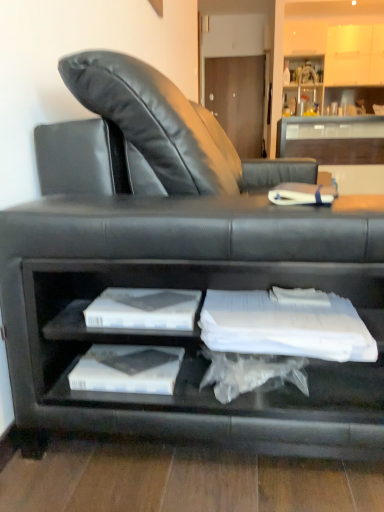
Question: Is white paper at center next to clear glass table at upper center and touching it?

Choices:
 (A) yes
 (B) no

Answer: (B)

Question: From the image's perspective, is white paper at center on top of clear glass table at upper center?

Choices:
 (A) yes
 (B) no

Answer: (B)

Question: Is white paper at center oriented towards clear glass table at upper center?

Choices:
 (A) no
 (B) yes

Answer: (A)

Question: Is white paper at center at the left side of clear glass table at upper center?

Choices:
 (A) no
 (B) yes

Answer: (B)

Question: Is white paper at center not inside clear glass table at upper center?

Choices:
 (A) no
 (B) yes

Answer: (B)

Question: In the image, is white paper at lower center positioned in front of or behind clear glass table at upper center?

Choices:
 (A) front
 (B) behind

Answer: (A)

Question: From a real-world perspective, relative to clear glass table at upper center, is white paper at lower center vertically above or below?

Choices:
 (A) above
 (B) below

Answer: (B)

Question: Considering the positions of white paper at lower center and clear glass table at upper center in the image, is white paper at lower center wider or thinner than clear glass table at upper center?

Choices:
 (A) wide
 (B) thin

Answer: (B)

Question: Is white paper at lower center to the left or to the right of clear glass table at upper center in the image?

Choices:
 (A) right
 (B) left

Answer: (B)

Question: From their relative heights in the image, would you say matte white cabinet at upper right is taller or shorter than white paper at center?

Choices:
 (A) tall
 (B) short

Answer: (A)

Question: Considering their positions, is matte white cabinet at upper right located in front of or behind white paper at center?

Choices:
 (A) front
 (B) behind

Answer: (B)

Question: From a real-world perspective, relative to white paper at center, is matte white cabinet at upper right vertically above or below?

Choices:
 (A) below
 (B) above

Answer: (B)

Question: Looking at their shapes, would you say matte white cabinet at upper right is wider or thinner than white paper at center?

Choices:
 (A) thin
 (B) wide

Answer: (A)

Question: In the image, is white paper at center on the left side or the right side of matte white cabinet at upper right?

Choices:
 (A) right
 (B) left

Answer: (B)

Question: Considering the positions of white paper at center and matte white cabinet at upper right in the image, is white paper at center bigger or smaller than matte white cabinet at upper right?

Choices:
 (A) big
 (B) small

Answer: (B)